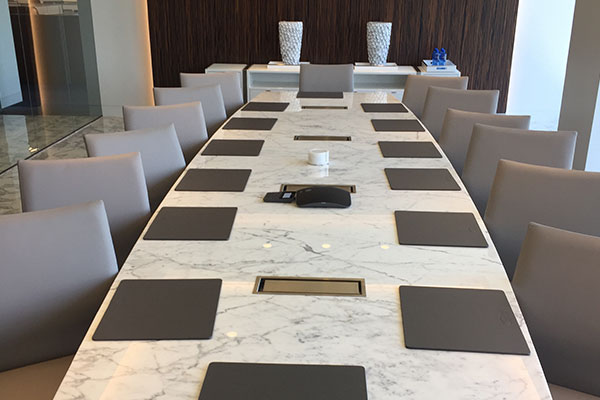
Find any wood paneling is it the 1980s? in the image. Your answer should be formatted as a list of tuples, i.e. [(x1, y1), (x2, y2), ...], where each tuple contains the x and y coordinates of a point satisfying the conditions above.

[(193, 45)]